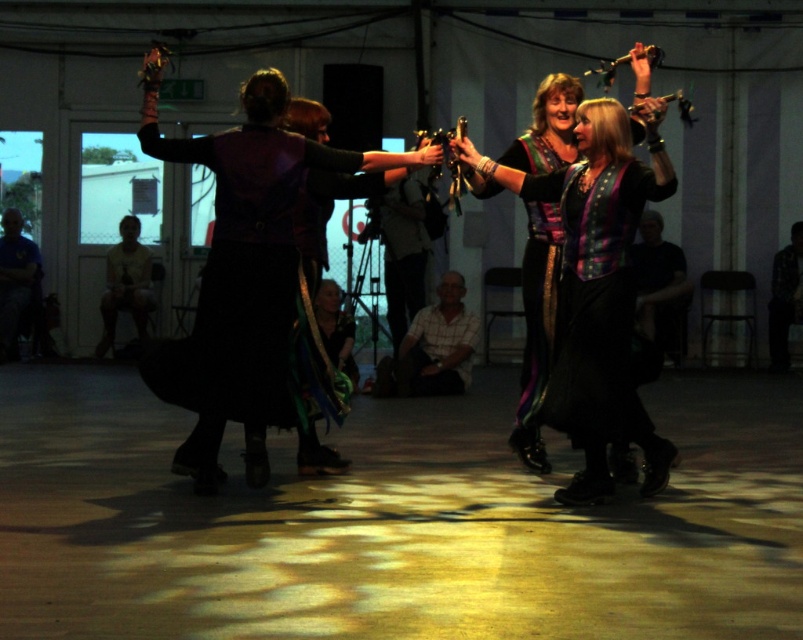
You are at the entrance of the tented event space and want to locate the matte purple vest at center. According to the coordinates provided, in which direction should you move from the entrance to find it?

The matte purple vest at center is located at coordinates point (243, 273). Since the entrance is likely near the tent door, you should move towards the center of the tent to find it.